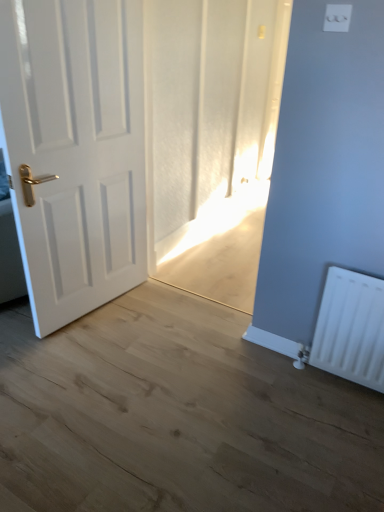
This screenshot has height=512, width=384. Describe the element at coordinates (337, 18) in the screenshot. I see `white plastic light switch at upper center` at that location.

Locate an element on the screen. The height and width of the screenshot is (512, 384). white plastic light switch at upper center is located at coordinates (337, 18).

The image size is (384, 512). I want to click on white matte door at left, so click(x=75, y=150).

What do you see at coordinates (75, 150) in the screenshot?
I see `white matte door at left` at bounding box center [75, 150].

Where is `white plastic light switch at upper center`? white plastic light switch at upper center is located at coordinates (337, 18).

In the image, there is a white matte door at left. At what (x,y) coordinates should I click in order to perform the action: click on radiator below it (from a real-world perspective). Please return your answer as a coordinate pair (x, y). This screenshot has height=512, width=384. Looking at the image, I should click on (351, 328).

From a real-world perspective, is white matte door at left above or below white plastic radiator at lower right?

white matte door at left is situated higher than white plastic radiator at lower right in the real world.

From a real-world perspective, is white plastic light switch at upper center positioned under white plastic radiator at lower right based on gravity?

Actually, white plastic light switch at upper center is physically above white plastic radiator at lower right in the real world.

Which object is positioned more to the right, white plastic light switch at upper center or white plastic radiator at lower right?

white plastic radiator at lower right is more to the right.

Between point (341, 6) and point (383, 308), which one is positioned in front?

Positioned in front is point (341, 6).

Is white plastic radiator at lower right oriented away from white matte door at left?

white plastic radiator at lower right does not have its back to white matte door at left.

Is white plastic radiator at lower right not near white matte door at left?

Absolutely, white plastic radiator at lower right is distant from white matte door at left.

What's the angular difference between white plastic radiator at lower right and white matte door at left's facing directions?

The angle between the facing direction of white plastic radiator at lower right and the facing direction of white matte door at left is 82.1 degrees.

Which of these two, white plastic radiator at lower right or white matte door at left, is smaller?

Smaller between the two is white plastic radiator at lower right.

Based on the photo, is white matte door at left far away from white plastic light switch at upper center?

white matte door at left is far away from white plastic light switch at upper center.

Is white matte door at left facing away from white plastic light switch at upper center?

No, white matte door at left's orientation is not away from white plastic light switch at upper center.

From the image's perspective, which is above, white matte door at left or white plastic light switch at upper center?

white plastic light switch at upper center appears higher in the image.

Considering the relative positions of white matte door at left and white plastic light switch at upper center in the image provided, is white matte door at left to the right of white plastic light switch at upper center from the viewer's perspective?

No, white matte door at left is not to the right of white plastic light switch at upper center.

Looking at the image, does white plastic light switch at upper center seem bigger or smaller compared to white matte door at left?

Clearly, white plastic light switch at upper center is smaller in size than white matte door at left.

From a real-world perspective, is white plastic light switch at upper center positioned over white matte door at left based on gravity?

Yes, from a real-world perspective, white plastic light switch at upper center is above white matte door at left.

Locate an element on the screen. light switch that is above the white matte door at left (from a real-world perspective) is located at coordinates (337, 18).

Are white plastic radiator at lower right and white plastic light switch at upper center far apart?

white plastic radiator at lower right is positioned a significant distance from white plastic light switch at upper center.

From a real-world perspective, is white plastic radiator at lower right physically above white plastic light switch at upper center?

No, from a real-world perspective, white plastic radiator at lower right is not on top of white plastic light switch at upper center.

Who is more distant, white plastic radiator at lower right or white plastic light switch at upper center?

white plastic radiator at lower right.

Considering the positions of objects white plastic radiator at lower right and white plastic light switch at upper center in the image provided, who is more to the right, white plastic radiator at lower right or white plastic light switch at upper center?

From the viewer's perspective, white plastic radiator at lower right appears more on the right side.

Locate an element on the screen. radiator that is behind the white matte door at left is located at coordinates (351, 328).

Identify the location of radiator below the white plastic light switch at upper center (from the image's perspective). The image size is (384, 512). (351, 328).

Based on their spatial positions, is white matte door at left or white plastic light switch at upper center closer to white plastic radiator at lower right?

white plastic light switch at upper center.

Estimate the real-world distances between objects in this image. Which object is closer to white matte door at left, white plastic light switch at upper center or white plastic radiator at lower right?

Based on the image, white plastic light switch at upper center appears to be nearer to white matte door at left.

Estimate the real-world distances between objects in this image. Which object is further from white plastic light switch at upper center, white plastic radiator at lower right or white matte door at left?

The object further to white plastic light switch at upper center is white matte door at left.

From the picture: Which object lies further to the anchor point white plastic radiator at lower right, white plastic light switch at upper center or white matte door at left?

white matte door at left is further to white plastic radiator at lower right.

Considering their positions, is white plastic radiator at lower right positioned further to white matte door at left than white plastic light switch at upper center?

The object further to white matte door at left is white plastic radiator at lower right.

Based on their spatial positions, is white matte door at left or white plastic radiator at lower right closer to white plastic light switch at upper center?

Based on the image, white plastic radiator at lower right appears to be nearer to white plastic light switch at upper center.

In order to click on light switch between white matte door at left and white plastic radiator at lower right in the horizontal direction in this screenshot , I will do (x=337, y=18).